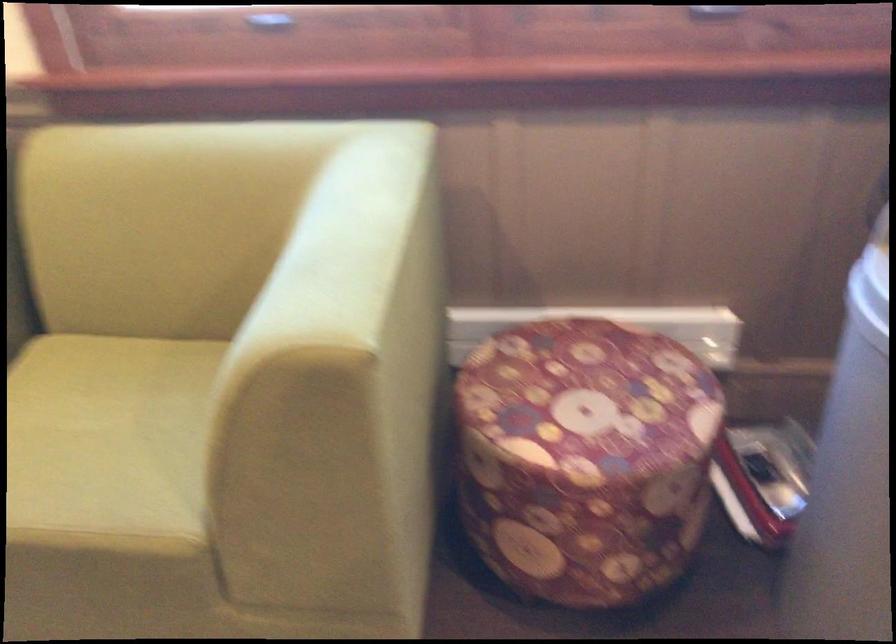
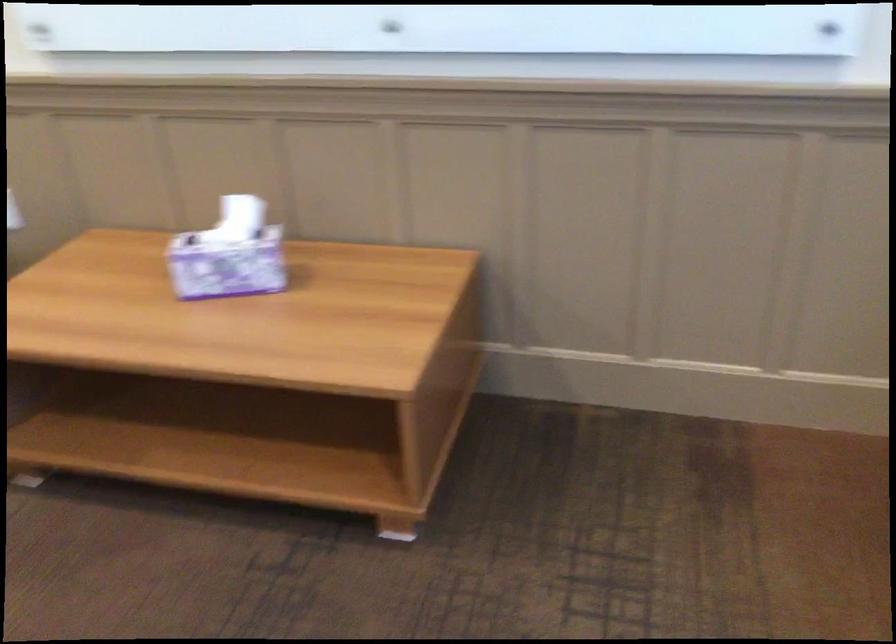
Based on the continuous images, in which direction is the camera rotating?

The camera rotated toward left-down.